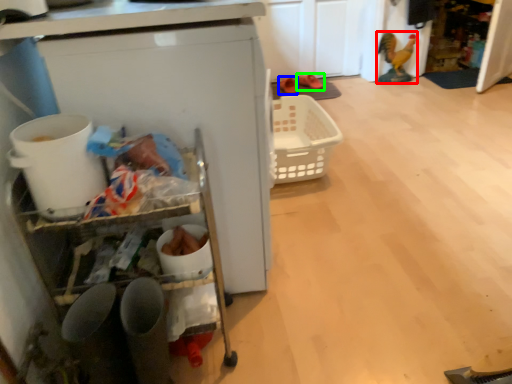
Question: Which object is positioned farthest from toy (highlighted by a red box)? Select from footwear (highlighted by a blue box) and footwear (highlighted by a green box).

Choices:
 (A) footwear
 (B) footwear

Answer: (A)